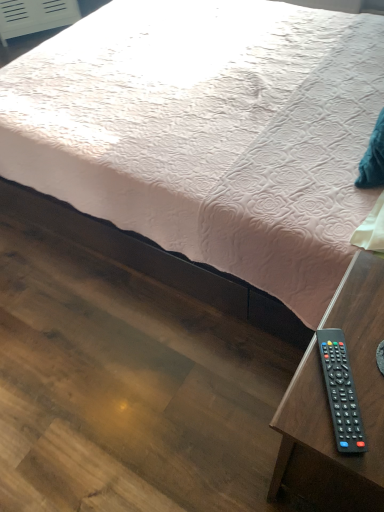
Question: Is black plastic remote at lower right taller or shorter than pink quilted fabric at center?

Choices:
 (A) short
 (B) tall

Answer: (A)

Question: Looking at their shapes, would you say black plastic remote at lower right is wider or thinner than pink quilted fabric at center?

Choices:
 (A) thin
 (B) wide

Answer: (A)

Question: Estimate the real-world distances between objects in this image. Which object is closer to the pink quilted fabric at center?

Choices:
 (A) black plastic remote at lower right
 (B) black plastic remote at lower right

Answer: (B)

Question: Which object is the farthest from the black plastic remote at lower right?

Choices:
 (A) black plastic remote at lower right
 (B) pink quilted fabric at center

Answer: (B)